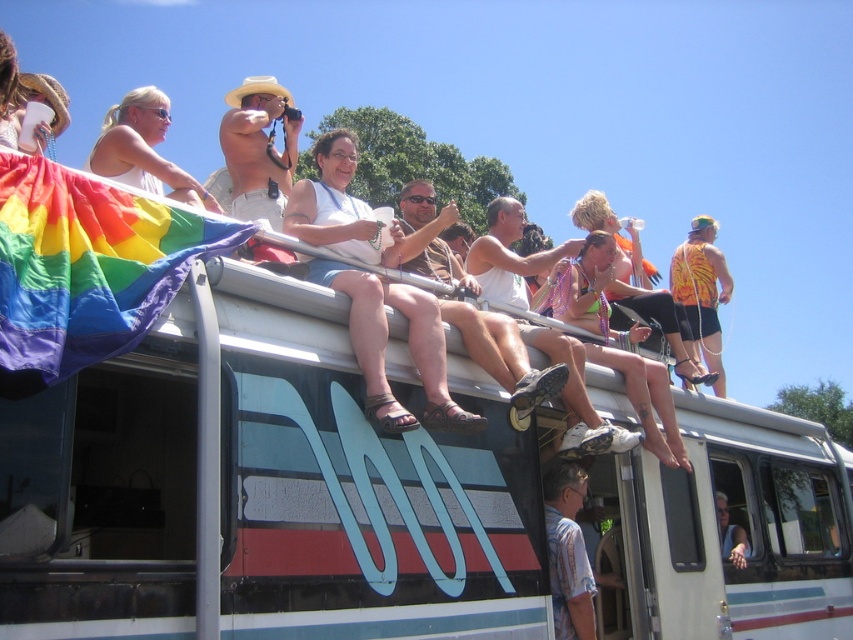
Is point (100, 138) closer to camera compared to point (727, 276)?

Yes, it is in front of point (727, 276).

Identify the location of matte white tank top at upper left. (143, 148).

Locate an element on the screen. The image size is (853, 640). matte white tank top at upper left is located at coordinates (143, 148).

At what (x,y) coordinates should I click in order to perform the action: click on matte white tank top at upper left. Please return your answer as a coordinate pair (x, y). Looking at the image, I should click on pos(143,148).

Can you confirm if matte white tank top at upper left is positioned to the left of white tank top at upper center?

Indeed, matte white tank top at upper left is positioned on the left side of white tank top at upper center.

Is matte white tank top at upper left taller than white tank top at upper center?

Yes, matte white tank top at upper left is taller than white tank top at upper center.

Who is more distant from viewer, (143,136) or (718,506)?

Point (143,136)

This screenshot has width=853, height=640. Find the location of `matte white tank top at upper left`. matte white tank top at upper left is located at coordinates (143, 148).

Can you confirm if orange tiger-striped tank top at upper right is positioned to the right of white tank top at upper center?

Yes, orange tiger-striped tank top at upper right is to the right of white tank top at upper center.

Is point (717, 369) behind point (740, 534)?

Yes, it is.

Is point (692, 227) positioned before point (740, 538)?

No, it is behind (740, 538).

Where is `orange tiger-striped tank top at upper right`? The width and height of the screenshot is (853, 640). orange tiger-striped tank top at upper right is located at coordinates (701, 292).